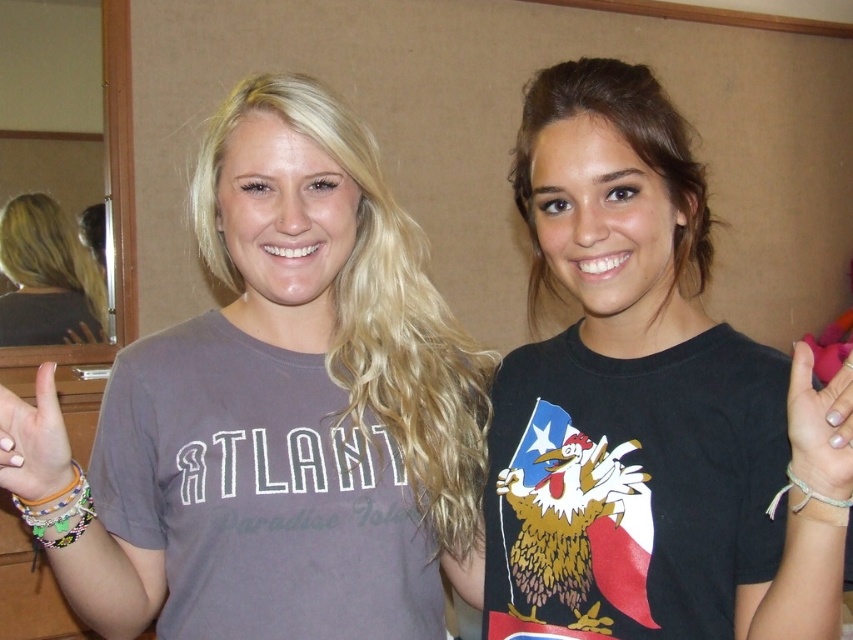
Based on the photo, is black matte t-shirt at center positioned before blonde hair at left?

That is True.

Does black matte t-shirt at center come behind blonde hair at left?

No.

The image size is (853, 640). Find the location of `black matte t-shirt at center`. black matte t-shirt at center is located at coordinates (637, 404).

Locate an element on the screen. This screenshot has width=853, height=640. black matte t-shirt at center is located at coordinates (637, 404).

The width and height of the screenshot is (853, 640). I want to click on matte gray t-shirt at center, so click(x=346, y=294).

Does matte gray t-shirt at center appear on the right side of matte orange nail polish at center?

Yes, matte gray t-shirt at center is to the right of matte orange nail polish at center.

What are the coordinates of `matte gray t-shirt at center` in the screenshot? It's located at (346, 294).

Identify the location of matte gray t-shirt at center. The height and width of the screenshot is (640, 853). (346, 294).

Can you confirm if black matte t-shirt at center is positioned below matte orange nail polish at center?

Actually, black matte t-shirt at center is above matte orange nail polish at center.

Does point (775, 493) come farther from viewer compared to point (1, 481)?

Yes.

Describe the element at coordinates (637, 404) in the screenshot. The image size is (853, 640). I see `black matte t-shirt at center` at that location.

The height and width of the screenshot is (640, 853). Find the location of `black matte t-shirt at center`. black matte t-shirt at center is located at coordinates (637, 404).